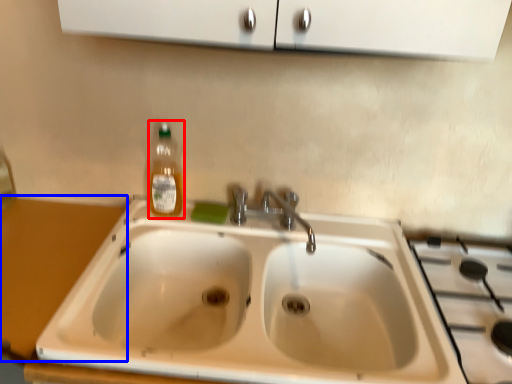
Question: Among these objects, which one is nearest to the camera, bottle (highlighted by a red box) or counter top (highlighted by a blue box)?

Choices:
 (A) bottle
 (B) counter top

Answer: (B)